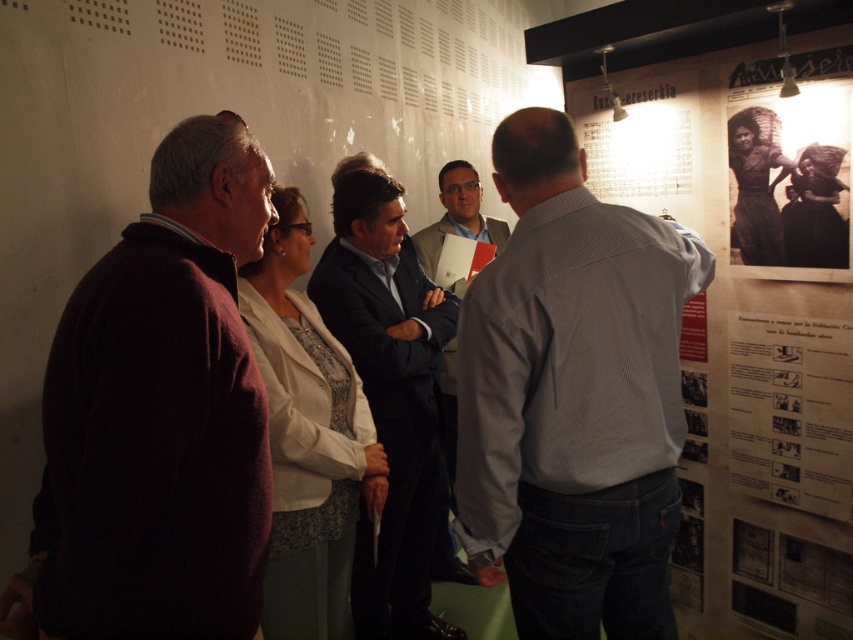
Looking at this image, you are standing in the museum and see the maroon sweater at left and the dark blue suit at center. Which person is closer to you?

The maroon sweater at left is positioned over the dark blue suit at center, so the person wearing the maroon sweater at left is closer to you.

You are an event planner setting up a photo shoot in this room. You need to place a large tripod between the wooden poster at right and the gray striped shirt at center. Based on their sizes, which object should the tripod be closer to?

The wooden poster at right is larger in size than the gray striped shirt at center, so the tripod should be placed closer to the wooden poster at right to accommodate its size.